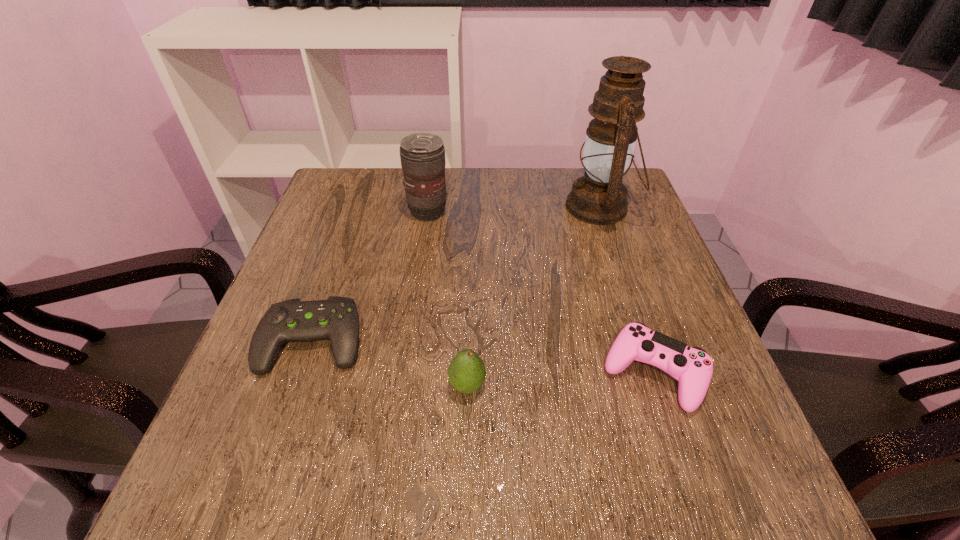
The image size is (960, 540). In order to click on free point that satisfies the following two spatial constraints: 1. on the back side of the taller control; 2. on the left side of the tallest object in this screenshot , I will do `click(598, 207)`.

You are a GUI agent. You are given a task and a screenshot of the screen. Output one action in this format:
    pyautogui.click(x=<x>, y=<y>)
    Task: Click on the vacant region that satisfies the following two spatial constraints: 1. on the side of the third shortest object where the control switches are located; 2. on the right side of the telephoto lens
    
    Given the screenshot: What is the action you would take?
    (x=403, y=386)

Locate an element on the screen. This screenshot has width=960, height=540. vacant region that satisfies the following two spatial constraints: 1. on the front side of the right control; 2. on the left side of the left control is located at coordinates (301, 374).

The width and height of the screenshot is (960, 540). I want to click on blank space that satisfies the following two spatial constraints: 1. on the back side of the second shortest object; 2. on the side of the fourth object from right to left where the control switches are located, so click(x=599, y=211).

At what (x,y) coordinates should I click in order to perform the action: click on free space that satisfies the following two spatial constraints: 1. on the side of the fourth object from right to left where the control switches are located; 2. on the front side of the shorter control. Please return your answer as a coordinate pair (x, y). The width and height of the screenshot is (960, 540). Looking at the image, I should click on (409, 341).

Identify the location of vacant space that satisfies the following two spatial constraints: 1. on the side of the avocado where the control switches are located; 2. on the left side of the second tallest object. tap(403, 386).